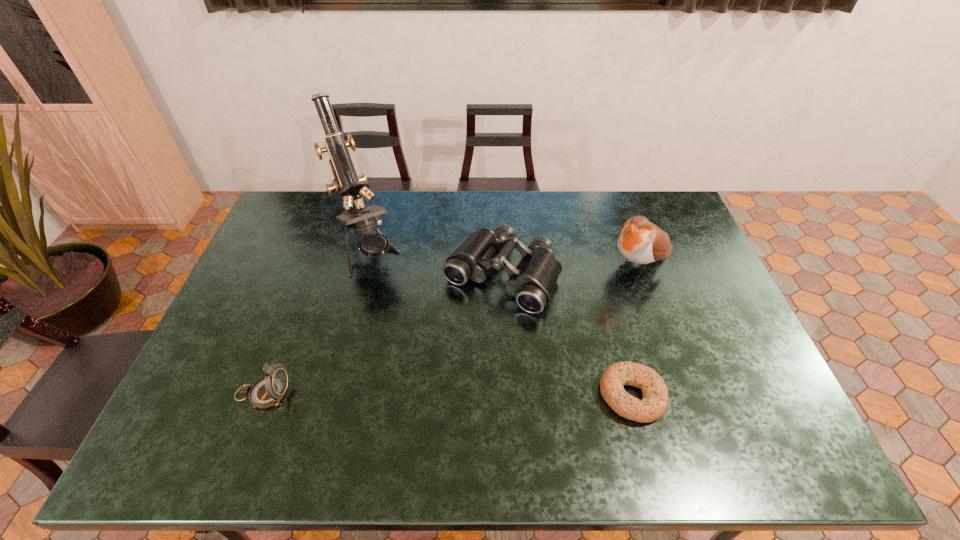
You are a GUI agent. You are given a task and a screenshot of the screen. Output one action in this format:
    pyautogui.click(x=<x>, y=<y>)
    Task: Click on the object located in the right edge section of the desktop
    
    Given the screenshot: What is the action you would take?
    pyautogui.click(x=640, y=241)

At what (x,y) coordinates should I click in order to perform the action: click on object present at the near left corner. Please return your answer as a coordinate pair (x, y). The image size is (960, 540). Looking at the image, I should click on (268, 391).

The width and height of the screenshot is (960, 540). Find the location of `free region at the far edge of the desktop`. free region at the far edge of the desktop is located at coordinates (435, 218).

In the image, there is a desktop. Find the location of `blank space at the near edge`. blank space at the near edge is located at coordinates (249, 405).

In the image, there is a desktop. Find the location of `vacant space at the left edge`. vacant space at the left edge is located at coordinates (233, 342).

You are a GUI agent. You are given a task and a screenshot of the screen. Output one action in this format:
    pyautogui.click(x=<x>, y=<y>)
    Task: Click on the vacant space at the right edge of the desktop
    This screenshot has height=540, width=960.
    Given the screenshot: What is the action you would take?
    pyautogui.click(x=747, y=362)

You are a GUI agent. You are given a task and a screenshot of the screen. Output one action in this format:
    pyautogui.click(x=<x>, y=<y>)
    Task: Click on the vacant space at the far left corner of the desktop
    This screenshot has width=960, height=540.
    Given the screenshot: What is the action you would take?
    pyautogui.click(x=324, y=209)

Where is `vacant space at the far right corner of the desktop`? The width and height of the screenshot is (960, 540). vacant space at the far right corner of the desktop is located at coordinates (672, 206).

Locate an element on the screen. vacant area that lies between the shortest object and the binoculars is located at coordinates (566, 335).

Where is `free spot between the second tallest object and the bagel`? free spot between the second tallest object and the bagel is located at coordinates (636, 330).